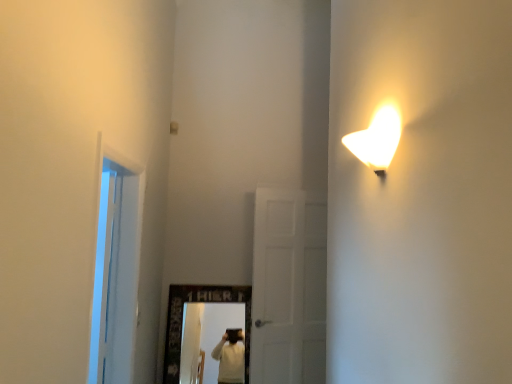
Question: From a real-world perspective, relative to transparent glass door at left, is white matte door at center vertically above or below?

Choices:
 (A) below
 (B) above

Answer: (A)

Question: Considering the positions of point (259, 188) and point (92, 319), is point (259, 188) closer or farther from the camera than point (92, 319)?

Choices:
 (A) closer
 (B) farther

Answer: (B)

Question: Considering the positions of white matte door at center and transparent glass door at left in the image, is white matte door at center bigger or smaller than transparent glass door at left?

Choices:
 (A) big
 (B) small

Answer: (B)

Question: Is point (113, 160) positioned closer to the camera than point (297, 211)?

Choices:
 (A) closer
 (B) farther

Answer: (A)

Question: Based on their sizes in the image, would you say transparent glass door at left is bigger or smaller than white matte door at center?

Choices:
 (A) small
 (B) big

Answer: (B)

Question: From the image's perspective, is transparent glass door at left positioned above or below white matte door at center?

Choices:
 (A) below
 (B) above

Answer: (B)

Question: From a real-world perspective, is transparent glass door at left positioned above or below white matte door at center?

Choices:
 (A) above
 (B) below

Answer: (A)